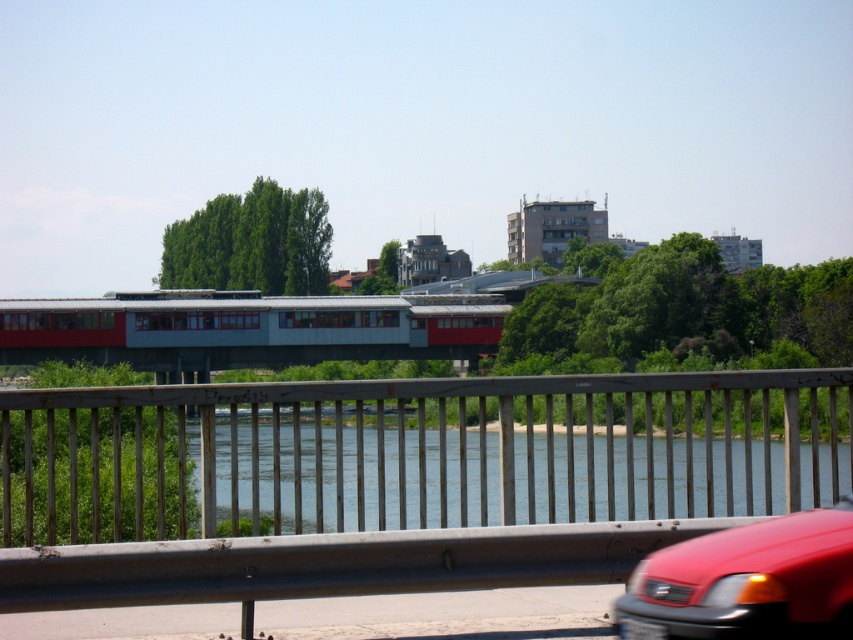
Based on the photo, you are a delivery person trying to carry a large package that is 1.2 meters wide. You need to pass through the space between the metallic gray railing at center and the glossy red car at lower right. Can your package fit through that space?

The metallic gray railing at center might be wider than the glossy red car at lower right, but since the exact width isn

You are standing on the bridge and want to take a photo of both the point at coordinates [490,500] and the point at coordinates [260,454]. Which point will appear closer to the bottom of your camera screen?

The point at coordinates [260,454] will appear closer to the bottom of the camera screen because it is closer to the camera than the point at coordinates [490,500].